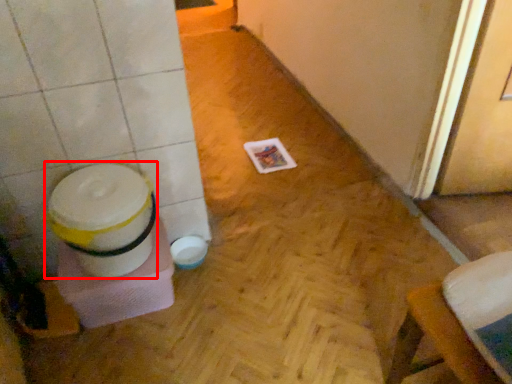
Question: From the image's perspective, considering the relative positions of potty (annotated by the red box) and screen door in the image provided, where is potty (annotated by the red box) located with respect to the staircase?

Choices:
 (A) above
 (B) below

Answer: (B)